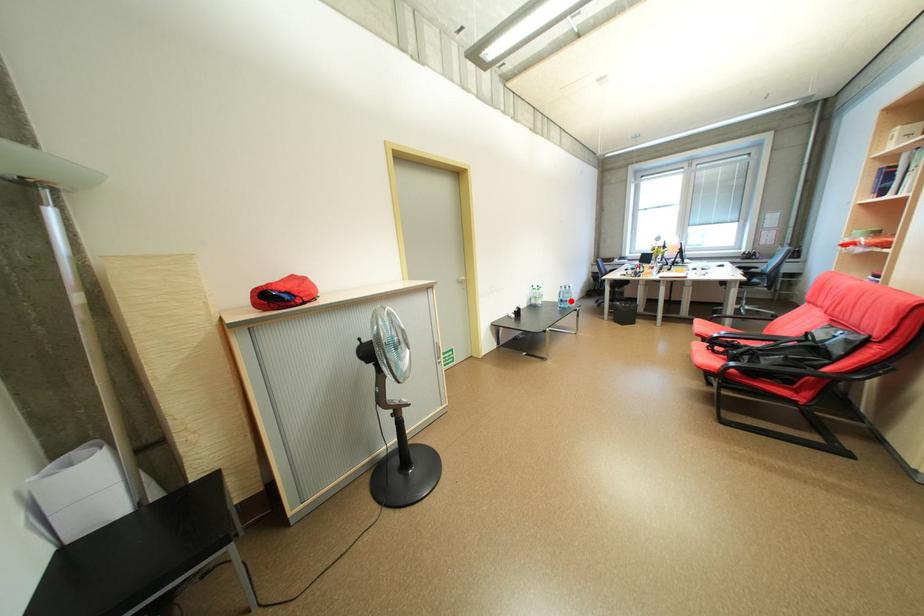
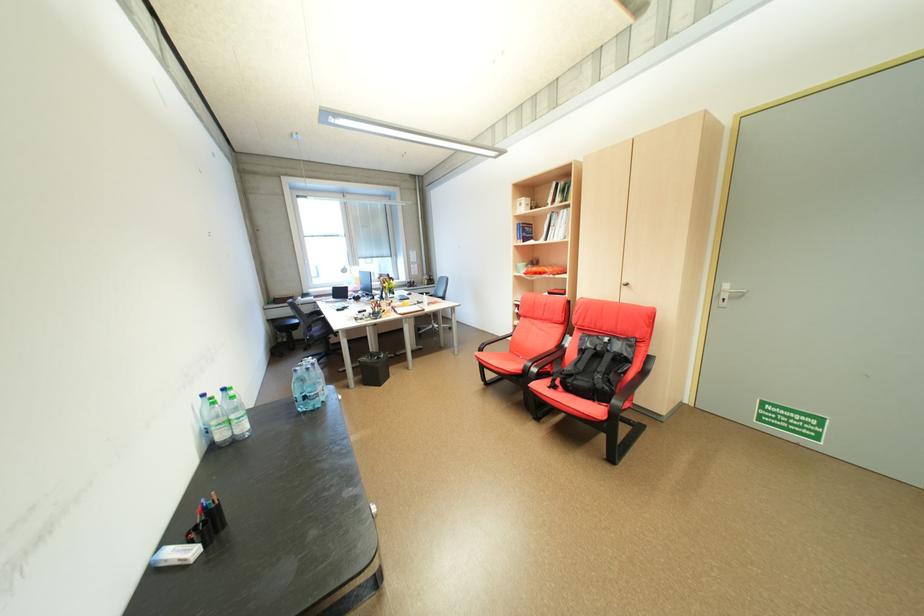
Where in the second image is the point corresponding to the highlighted location from the first image?

(313, 398)